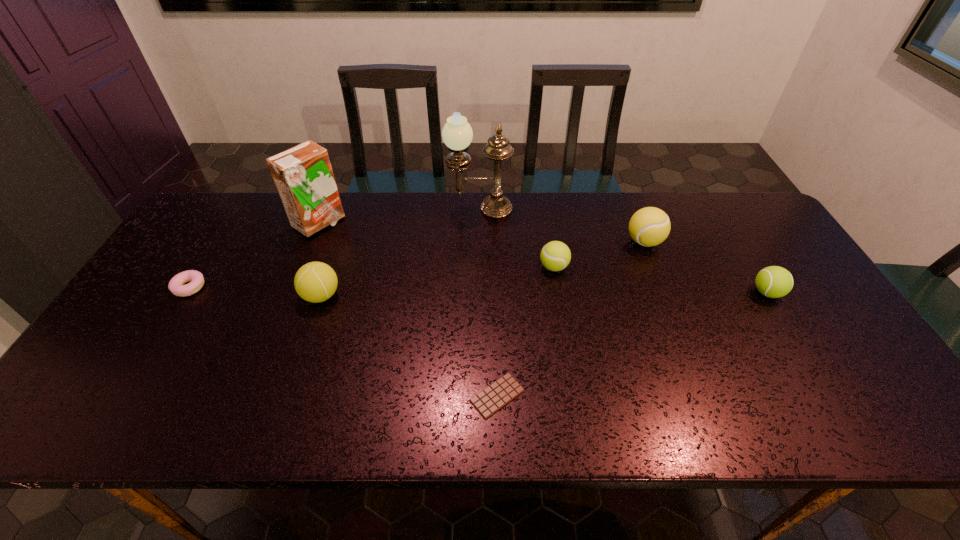
The width and height of the screenshot is (960, 540). I want to click on oil lamp that is at the far edge, so click(457, 134).

You are a GUI agent. You are given a task and a screenshot of the screen. Output one action in this format:
    pyautogui.click(x=<x>, y=<y>)
    Task: Click on the carton that is at the far edge
    
    Given the screenshot: What is the action you would take?
    pyautogui.click(x=303, y=176)

You are a GUI agent. You are given a task and a screenshot of the screen. Output one action in this format:
    pyautogui.click(x=<x>, y=<y>)
    Task: Click on the tennis ball located in the far edge section of the desktop
    
    Given the screenshot: What is the action you would take?
    [649, 226]

Find the location of a particular element. object that is positioned at the near edge is located at coordinates (497, 395).

You are a GUI agent. You are given a task and a screenshot of the screen. Output one action in this format:
    pyautogui.click(x=<x>, y=<y>)
    Task: Click on the object located at the left edge
    The width and height of the screenshot is (960, 540).
    Given the screenshot: What is the action you would take?
    pyautogui.click(x=176, y=286)

Locate an element on the screen. Image resolution: width=960 pixels, height=540 pixels. object present at the right edge is located at coordinates (773, 281).

This screenshot has width=960, height=540. I want to click on vacant space at the far edge of the desktop, so click(x=237, y=237).

At what (x,y) coordinates should I click in order to perform the action: click on free space at the near edge of the desktop. Please return your answer as a coordinate pair (x, y). The height and width of the screenshot is (540, 960). Looking at the image, I should click on (556, 406).

In order to click on vacant space at the right edge of the desktop in this screenshot , I will do `click(768, 306)`.

Locate an element on the screen. free space at the near left corner of the desktop is located at coordinates tap(60, 432).